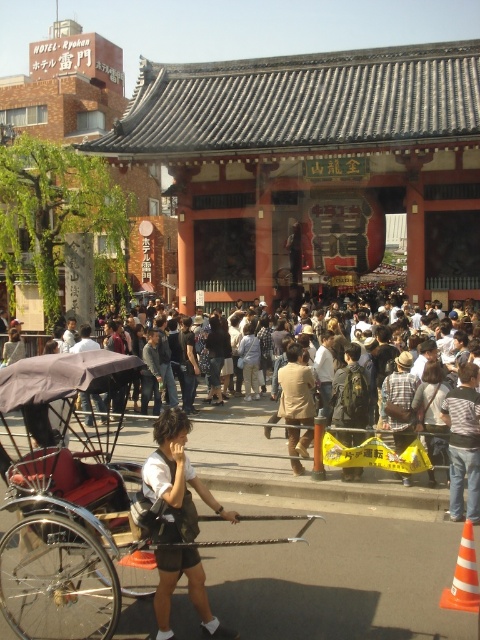
Is white fabric shirt at center taller than striped shirt at center?

Incorrect, white fabric shirt at center's height is not larger of striped shirt at center's.

Which is in front, point (172, 560) or point (458, 433)?

Point (172, 560) is more forward.

Where is `white fabric shirt at center`? The height and width of the screenshot is (640, 480). white fabric shirt at center is located at coordinates (176, 481).

Can you confirm if wooden cart at center is positioned to the left of white fabric shirt at center?

Indeed, wooden cart at center is positioned on the left side of white fabric shirt at center.

Does wooden cart at center have a lesser height compared to white fabric shirt at center?

Correct, wooden cart at center is not as tall as white fabric shirt at center.

Identify the location of wooden cart at center. (76, 502).

Between wooden cart at center and striped shirt at center, which one is positioned lower?

Positioned lower is wooden cart at center.

Between point (59, 536) and point (476, 376), which one is positioned behind?

Positioned behind is point (476, 376).

This screenshot has height=640, width=480. I want to click on wooden cart at center, so 76,502.